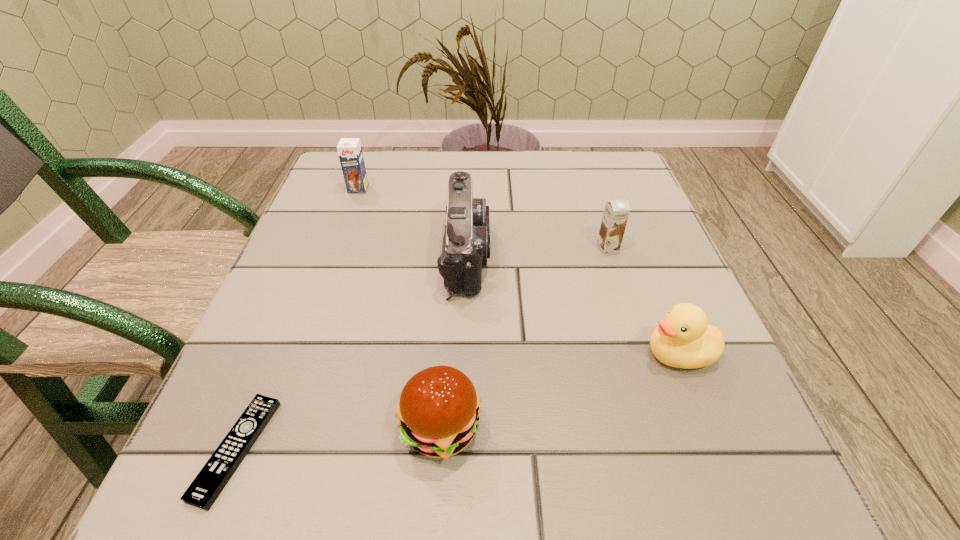
Find the location of a particular element. This screenshot has height=540, width=960. the farthest object is located at coordinates (349, 150).

At what (x,y) coordinates should I click in order to perform the action: click on the left chocolate milk. Please return your answer as a coordinate pair (x, y). This screenshot has width=960, height=540. Looking at the image, I should click on (349, 150).

Where is `camcorder`? camcorder is located at coordinates (466, 242).

I want to click on the right chocolate milk, so click(616, 212).

Find the location of a particular element. the fourth farthest object is located at coordinates (683, 339).

Identify the location of hamburger. The height and width of the screenshot is (540, 960). (439, 410).

Locate an element on the screen. Image resolution: width=960 pixels, height=540 pixels. remote control is located at coordinates (206, 487).

Where is `blank space located 0.110m on the front label of the farther chocolate milk`? The width and height of the screenshot is (960, 540). blank space located 0.110m on the front label of the farther chocolate milk is located at coordinates (347, 222).

In order to click on vacant space located 0.090m on the front-facing side of the camcorder in this screenshot , I will do `click(536, 254)`.

This screenshot has width=960, height=540. In order to click on vacant space situated on the right of the nearer chocolate milk in this screenshot , I will do `click(662, 247)`.